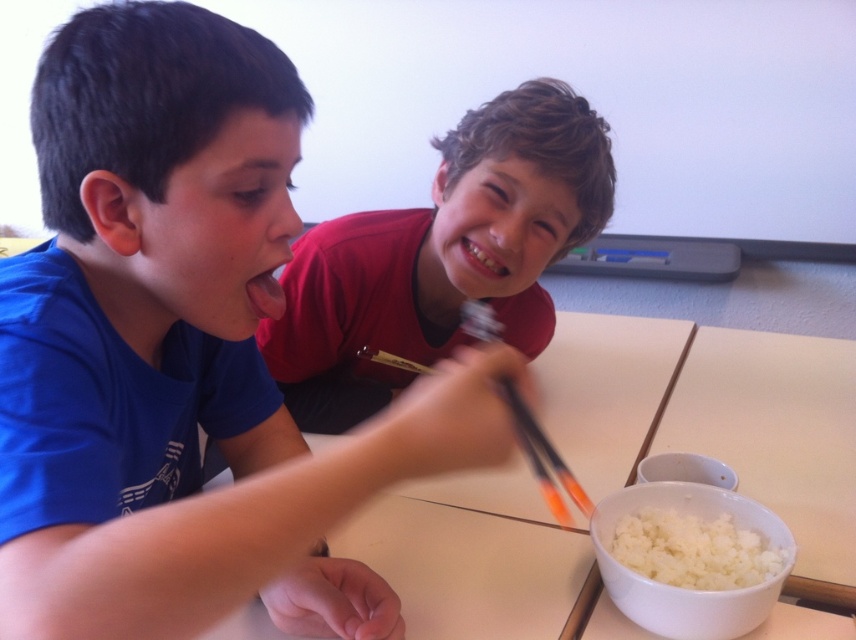
Question: Is white matte table at center thinner than white fluffy rice at lower right?

Choices:
 (A) no
 (B) yes

Answer: (A)

Question: Is white matte table at center positioned in front of red matte shirt at upper center?

Choices:
 (A) no
 (B) yes

Answer: (B)

Question: Which point appears closest to the camera in this image?

Choices:
 (A) (633, 545)
 (B) (524, 330)
 (C) (562, 381)

Answer: (A)

Question: Among these objects, which one is nearest to the camera?

Choices:
 (A) white matte table at center
 (B) blue t-shirt at upper left
 (C) white fluffy rice at lower right
 (D) red matte shirt at upper center

Answer: (B)

Question: Is white matte table at center below white fluffy rice at lower right?

Choices:
 (A) no
 (B) yes

Answer: (A)

Question: Which point is farther to the camera?

Choices:
 (A) (716, 547)
 (B) (28, 584)
 (C) (541, 237)

Answer: (C)